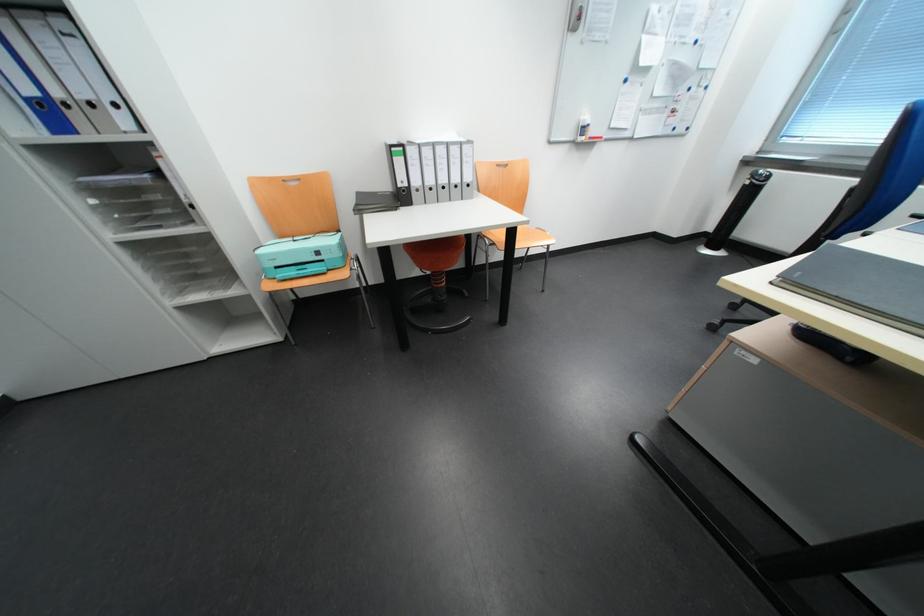
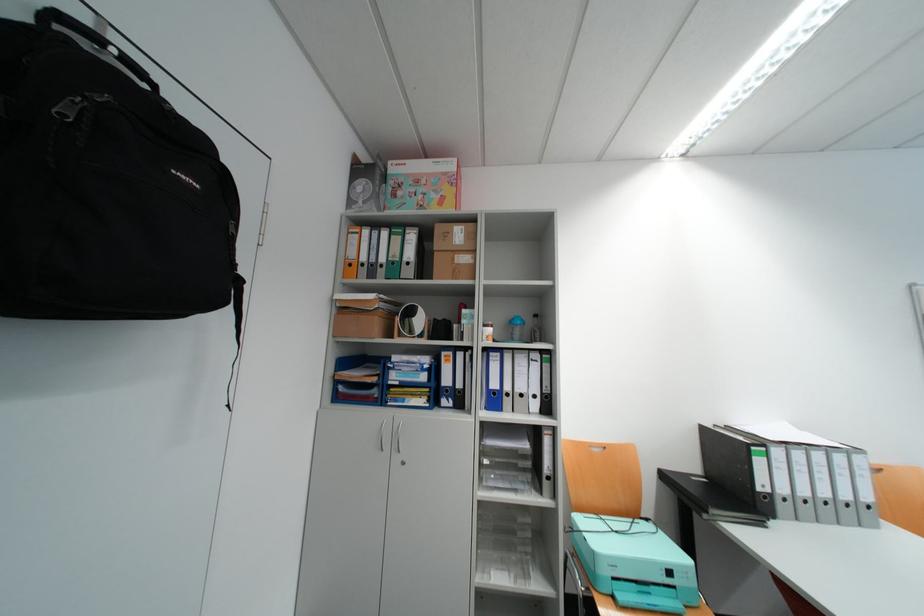
Where in the second image is the point corresponding to point 330,254 from the first image?

(682, 573)